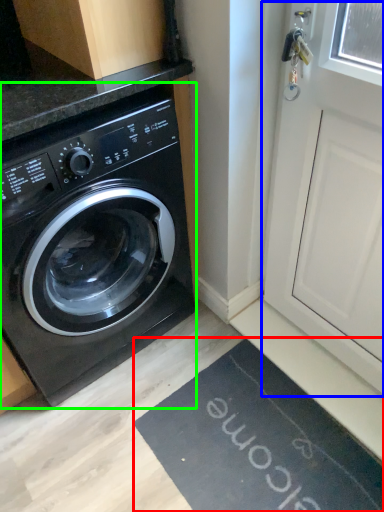
Question: Estimate the real-world distances between objects in this image. Which object is farther from bath mat (highlighted by a red box), screen door (highlighted by a blue box) or washing machine (highlighted by a green box)?

Choices:
 (A) screen door
 (B) washing machine

Answer: (B)